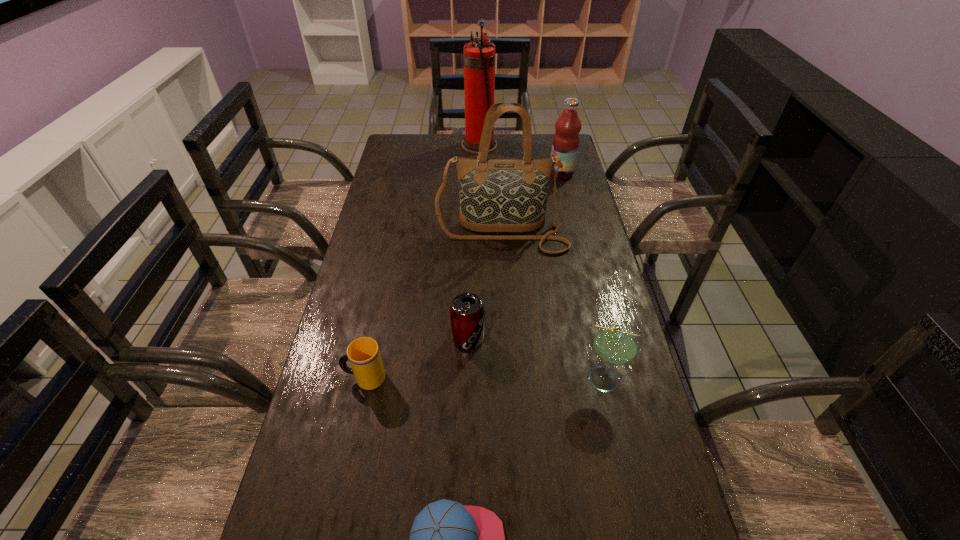
Identify the location of object that is the fifth closest to the cup. This screenshot has width=960, height=540. (565, 144).

Where is `free space in the image that satisfies the following two spatial constraints: 1. at the discharge end of the martini; 2. on the right side of the farthest object`? free space in the image that satisfies the following two spatial constraints: 1. at the discharge end of the martini; 2. on the right side of the farthest object is located at coordinates (479, 379).

At what (x,y) coordinates should I click in order to perform the action: click on free spot that satisfies the following two spatial constraints: 1. on the front label of the fifth shortest object; 2. on the front-facing side of the third farthest object. Please return your answer as a coordinate pair (x, y). The height and width of the screenshot is (540, 960). Looking at the image, I should click on (576, 233).

Where is `free region that satisfies the following two spatial constraints: 1. on the front-facing side of the martini; 2. on the right side of the third farthest object`? free region that satisfies the following two spatial constraints: 1. on the front-facing side of the martini; 2. on the right side of the third farthest object is located at coordinates (510, 379).